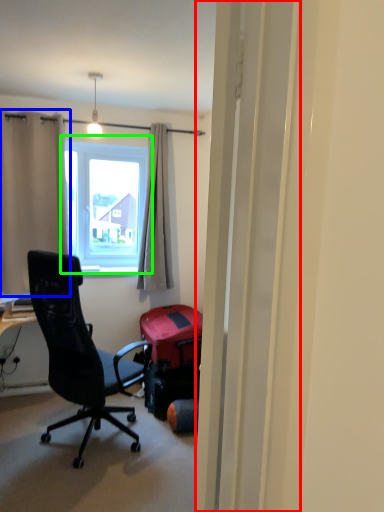
Question: Considering the real-world distances, which object is closest to screen door (highlighted by a red box)? curtain (highlighted by a blue box) or window (highlighted by a green box).

Choices:
 (A) curtain
 (B) window

Answer: (A)